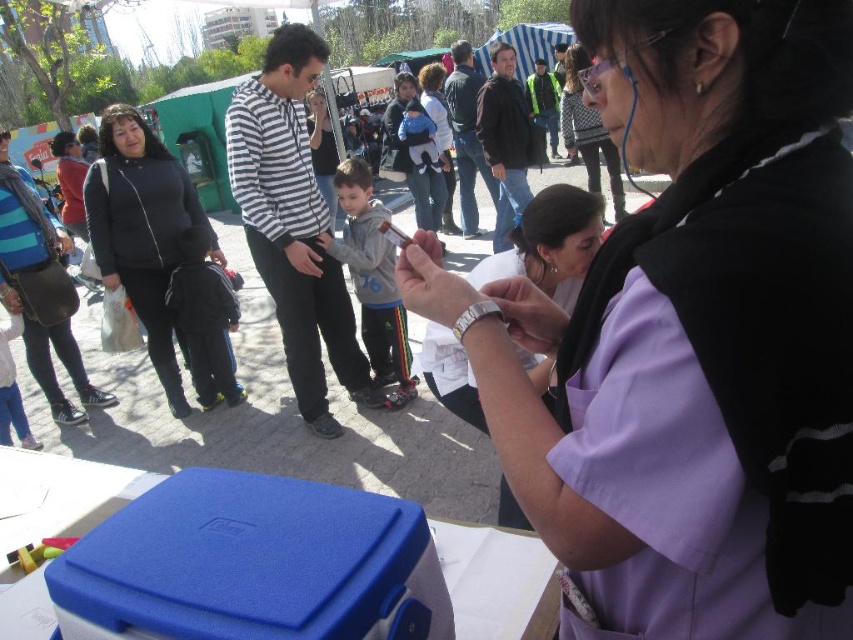
Question: Which of the following is the closest to the observer?

Choices:
 (A) blue foam cooler at lower left
 (B) gray fleece jacket at center
 (C) purple fabric shirt at center

Answer: (C)

Question: Can you confirm if purple fabric shirt at center is bigger than blue foam cooler at lower left?

Choices:
 (A) yes
 (B) no

Answer: (A)

Question: Can you confirm if blue foam cooler at lower left is positioned to the right of matte purple shirt at center?

Choices:
 (A) no
 (B) yes

Answer: (A)

Question: Among these points, which one is farthest from the camera?

Choices:
 (A) (96, 232)
 (B) (177, 288)
 (C) (581, 120)
 (D) (354, 161)

Answer: (C)

Question: Is gray fleece jacket at center smaller than matte purple shirt at center?

Choices:
 (A) yes
 (B) no

Answer: (A)

Question: Which object is positioned farthest from the black soft jacket at left?

Choices:
 (A) dark gray fleece jacket at center
 (B) matte purple shirt at center
 (C) gray fleece jacket at center
 (D) purple fabric shirt at center

Answer: (B)